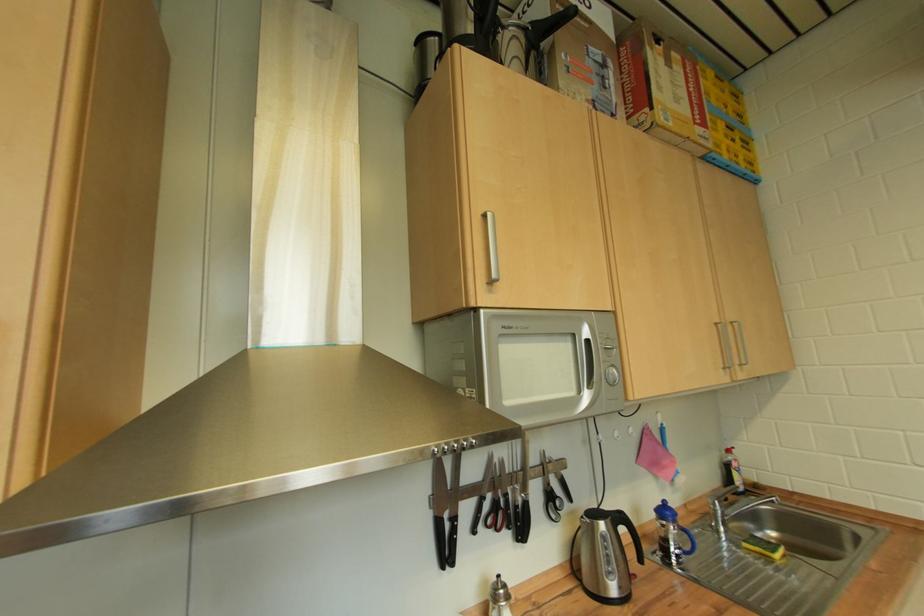
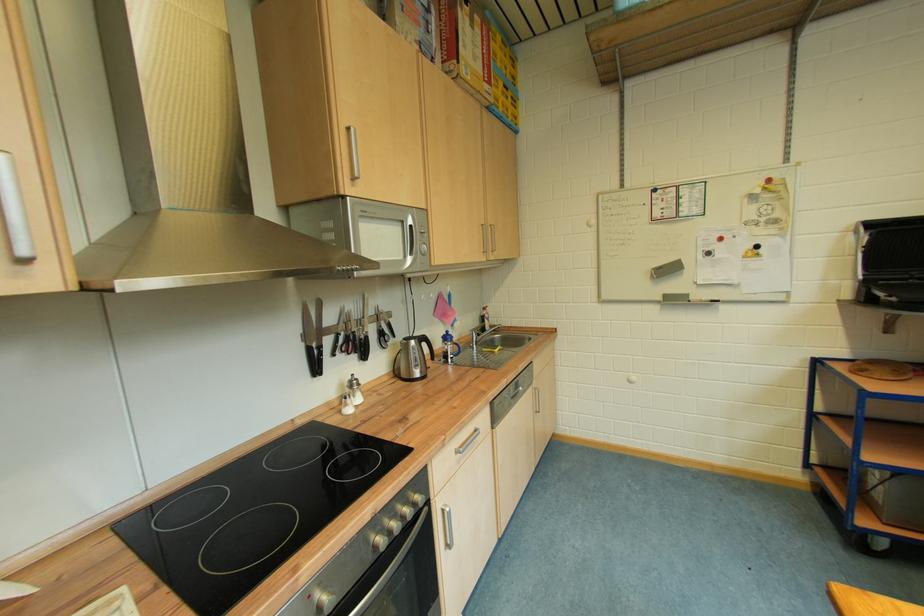
The point at (492, 585) is marked in the first image. Where is the corresponding point in the second image?

(349, 387)